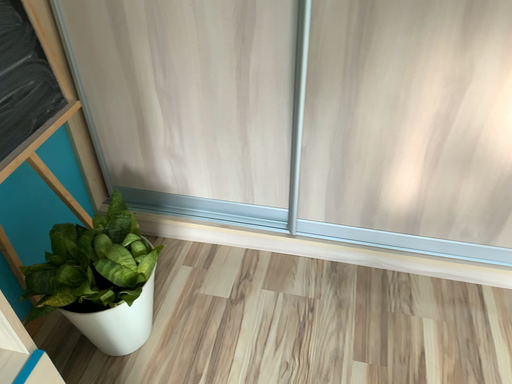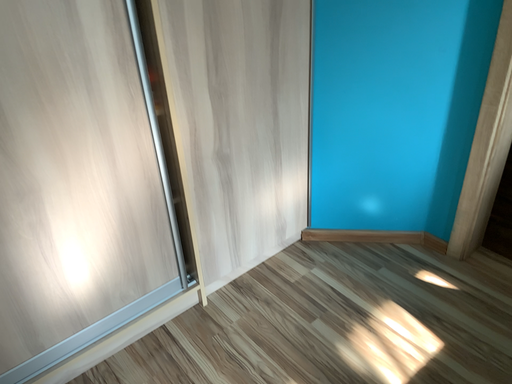
Question: How did the camera likely rotate when shooting the video?

Choices:
 (A) rotated left
 (B) rotated right

Answer: (B)